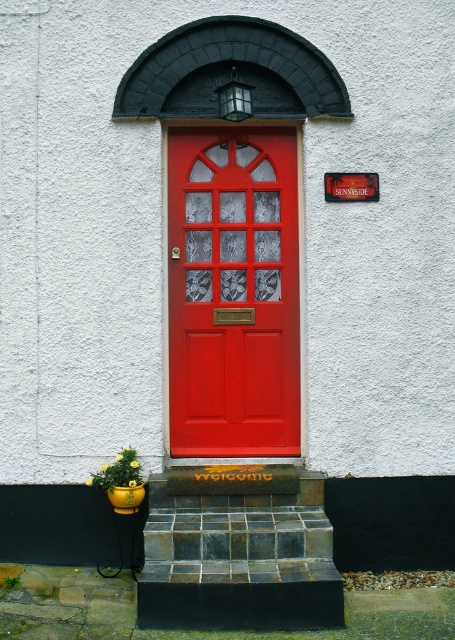
Can you confirm if matte red door at center is bigger than dark gray stone stairs at center?

Incorrect, matte red door at center is not larger than dark gray stone stairs at center.

Is point (292, 346) positioned after point (227, 604)?

Yes, it is.

Is point (281, 451) farther from camera compared to point (239, 538)?

Yes, point (281, 451) is farther from viewer.

Locate an element on the screen. matte red door at center is located at coordinates pos(232,291).